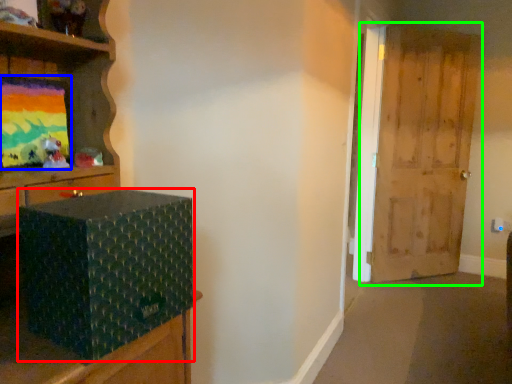
Question: Estimate the real-world distances between objects in this image. Which object is closer to box (highlighted by a red box), picture frame (highlighted by a blue box) or door (highlighted by a green box)?

Choices:
 (A) picture frame
 (B) door

Answer: (A)